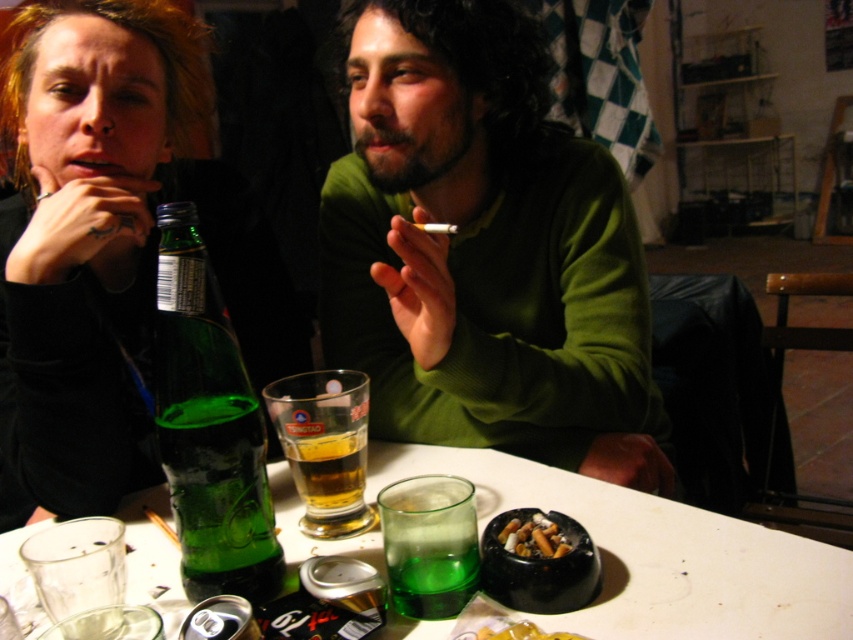
What is the 2D coordinate of the green glass bottle at center?

The 2D coordinate of the green glass bottle at center is at point (207, 428).

You are a bartender who needs to place a new drink order on the table. The table has a green glass bottle at center and a charcoal ashtray at table center. Where should you place the new drink to avoid covering the ashtray?

The green glass bottle at center is above the charcoal ashtray at table center, so placing the new drink below the green glass bottle at center would avoid covering the ashtray.